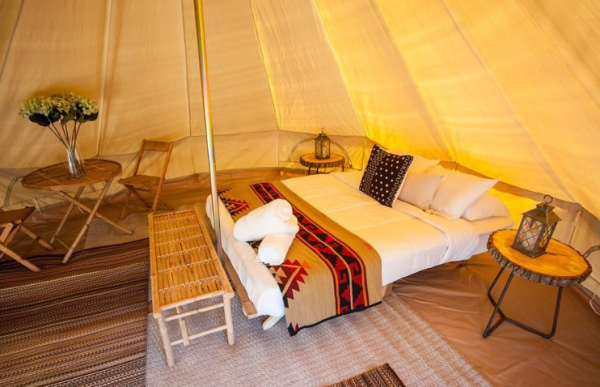
Locate an element on the screen. end tables is located at coordinates (554, 268), (322, 159).